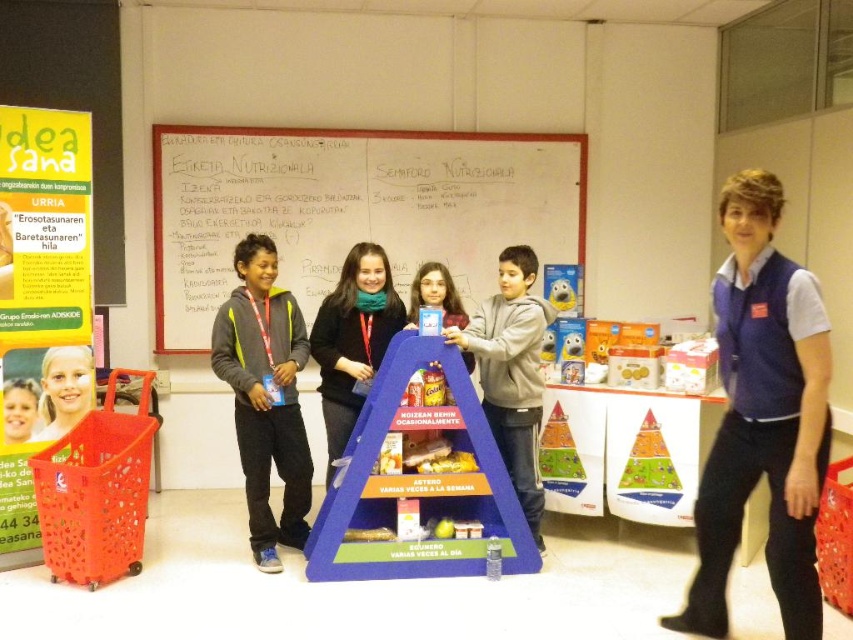
Is matte black sweater at center positioned at the back of blonde hair at center?

Yes, it is behind blonde hair at center.

The width and height of the screenshot is (853, 640). What are the coordinates of `matte black sweater at center` in the screenshot? It's located at (352, 339).

Is the position of gray fleece hoodie at center more distant than that of blonde hair at center?

No.

Is point (277, 564) behind point (59, 349)?

No, (277, 564) is in front of (59, 349).

The image size is (853, 640). Find the location of `gray fleece hoodie at center`. gray fleece hoodie at center is located at coordinates pos(265,396).

Is the position of blue fabric vest at center less distant than that of blue cardboard pyramid at center?

Yes, it is.

The image size is (853, 640). What do you see at coordinates (762, 417) in the screenshot? I see `blue fabric vest at center` at bounding box center [762, 417].

Image resolution: width=853 pixels, height=640 pixels. Find the location of `blue fabric vest at center`. blue fabric vest at center is located at coordinates (762, 417).